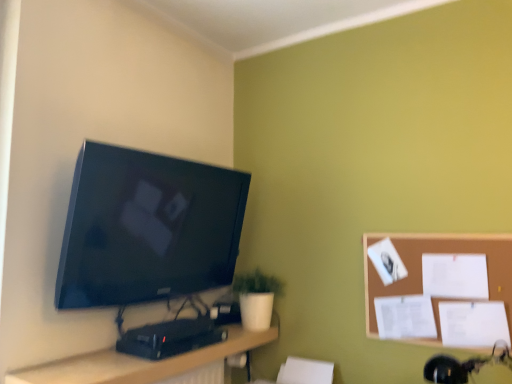
Describe the element at coordinates (438, 252) in the screenshot. I see `brown corkboard at right` at that location.

What is the approximate width of brown corkboard at right?

The width of brown corkboard at right is 2.48 centimeters.

The image size is (512, 384). What are the coordinates of `wooden desk at lower center` in the screenshot? It's located at (137, 363).

What do you see at coordinates (256, 298) in the screenshot? The image size is (512, 384). I see `white matte pot at lower center` at bounding box center [256, 298].

Where is `brown corkboard at right`? Image resolution: width=512 pixels, height=384 pixels. brown corkboard at right is located at coordinates (438, 252).

What's the angular difference between wooden desk at lower center and white matte pot at lower center's facing directions?

There is a 0.00083-degree angle between the facing directions of wooden desk at lower center and white matte pot at lower center.

Consider the image. Which of these two, wooden desk at lower center or white matte pot at lower center, stands shorter?

Standing shorter between the two is wooden desk at lower center.

From the image's perspective, would you say wooden desk at lower center is shown under white matte pot at lower center?

Correct, wooden desk at lower center appears lower than white matte pot at lower center in the image.

Considering the relative sizes of wooden desk at lower center and white matte pot at lower center in the image provided, is wooden desk at lower center wider than white matte pot at lower center?

No.

Is white matte pot at lower center bigger than wooden desk at lower center?

Incorrect, white matte pot at lower center is not larger than wooden desk at lower center.

Where is `houseplant on the right of the wooden desk at lower center`? This screenshot has height=384, width=512. houseplant on the right of the wooden desk at lower center is located at coordinates (256, 298).

In the scene shown: Between white matte pot at lower center and wooden desk at lower center, which one has less height?

With less height is wooden desk at lower center.

Considering the positions of point (253, 318) and point (78, 364), is point (253, 318) closer or farther from the camera than point (78, 364)?

Point (253, 318) appears to be farther away from the viewer than point (78, 364).

Is matte black tv at upper left oriented away from brown corkboard at right?

No, brown corkboard at right is not at the back of matte black tv at upper left.

Which object is positioned more to the left, matte black tv at upper left or brown corkboard at right?

Positioned to the left is matte black tv at upper left.

Find the location of `television lying above the brown corkboard at right (from the image's perspective)`. television lying above the brown corkboard at right (from the image's perspective) is located at coordinates pyautogui.click(x=147, y=228).

Considering the sizes of wooden desk at lower center and matte black tv at upper left in the image, is wooden desk at lower center wider or thinner than matte black tv at upper left?

Considering their sizes, wooden desk at lower center looks broader than matte black tv at upper left.

Find the location of a particular element. The height and width of the screenshot is (384, 512). desk on the left of matte black tv at upper left is located at coordinates (137, 363).

Does point (267, 335) come farther from viewer compared to point (113, 207)?

Yes, it is.

Is matte black tv at upper left surrounded by wooden desk at lower center?

That's incorrect, matte black tv at upper left is not inside wooden desk at lower center.

From the image's perspective, would you say brown corkboard at right is positioned over wooden desk at lower center?

A: Yes, from the image's perspective, brown corkboard at right is on top of wooden desk at lower center.

Between brown corkboard at right and wooden desk at lower center, which one has less height?

Standing shorter between the two is wooden desk at lower center.

Image resolution: width=512 pixels, height=384 pixels. What are the coordinates of `desk below the brown corkboard at right (from the image's perspective)` in the screenshot? It's located at (137, 363).

Which object is thinner, brown corkboard at right or wooden desk at lower center?

brown corkboard at right.

Where is `houseplant that is under the brown corkboard at right (from a real-world perspective)`? houseplant that is under the brown corkboard at right (from a real-world perspective) is located at coordinates (256, 298).

Is white matte pot at lower center bigger than brown corkboard at right?

Yes, white matte pot at lower center is bigger than brown corkboard at right.

Would you say white matte pot at lower center is inside or outside brown corkboard at right?

white matte pot at lower center lies outside brown corkboard at right.

From a real-world perspective, is white matte pot at lower center physically located above or below brown corkboard at right?

In terms of real-world spatial position, white matte pot at lower center is below brown corkboard at right.

In terms of width, does brown corkboard at right look wider or thinner when compared to white matte pot at lower center?

Clearly, brown corkboard at right has less width compared to white matte pot at lower center.

Is brown corkboard at right not inside white matte pot at lower center?

Yes, brown corkboard at right is located beyond the bounds of white matte pot at lower center.

Locate an element on the screen. This screenshot has width=512, height=384. houseplant below the brown corkboard at right (from a real-world perspective) is located at coordinates (256, 298).

Is brown corkboard at right turned away from white matte pot at lower center?

No, brown corkboard at right's orientation is not away from white matte pot at lower center.

You are a GUI agent. You are given a task and a screenshot of the screen. Output one action in this format:
    pyautogui.click(x=<x>, y=<y>)
    Task: Click on the desk located on the left of white matte pot at lower center
    
    Given the screenshot: What is the action you would take?
    click(x=137, y=363)

This screenshot has height=384, width=512. I want to click on desk located below the white matte pot at lower center (from the image's perspective), so click(x=137, y=363).

Based on the photo, from the image, which object appears to be nearer to brown corkboard at right, white matte pot at lower center or matte black tv at upper left?

The object closer to brown corkboard at right is white matte pot at lower center.

Looking at the image, which one is located closer to matte black tv at upper left, white matte pot at lower center or wooden desk at lower center?

Among the two, wooden desk at lower center is located nearer to matte black tv at upper left.

Based on their spatial positions, is brown corkboard at right or matte black tv at upper left further from wooden desk at lower center?

brown corkboard at right is further to wooden desk at lower center.

When comparing their distances from matte black tv at upper left, does brown corkboard at right or white matte pot at lower center seem closer?

Among the two, white matte pot at lower center is located nearer to matte black tv at upper left.

Based on their spatial positions, is wooden desk at lower center or brown corkboard at right closer to matte black tv at upper left?

wooden desk at lower center is positioned closer to the anchor matte black tv at upper left.

Which object lies further to the anchor point white matte pot at lower center, matte black tv at upper left or wooden desk at lower center?

matte black tv at upper left lies further to white matte pot at lower center than the other object.

From the picture: From the image, which object appears to be farther from white matte pot at lower center, brown corkboard at right or wooden desk at lower center?

brown corkboard at right is positioned further to the anchor white matte pot at lower center.

Which object lies further to the anchor point white matte pot at lower center, wooden desk at lower center or matte black tv at upper left?

Among the two, matte black tv at upper left is located further to white matte pot at lower center.

Find the location of a particular element. houseplant between wooden desk at lower center and brown corkboard at right is located at coordinates [x=256, y=298].

The image size is (512, 384). Identify the location of houseplant located between matte black tv at upper left and brown corkboard at right in the left-right direction. (256, 298).

Where is `television between wooden desk at lower center and white matte pot at lower center in the front-back direction`? television between wooden desk at lower center and white matte pot at lower center in the front-back direction is located at coordinates (147, 228).

You are a GUI agent. You are given a task and a screenshot of the screen. Output one action in this format:
    pyautogui.click(x=<x>, y=<y>)
    Task: Click on the television located between wooden desk at lower center and brown corkboard at right in the left-right direction
    The width and height of the screenshot is (512, 384).
    Given the screenshot: What is the action you would take?
    pyautogui.click(x=147, y=228)